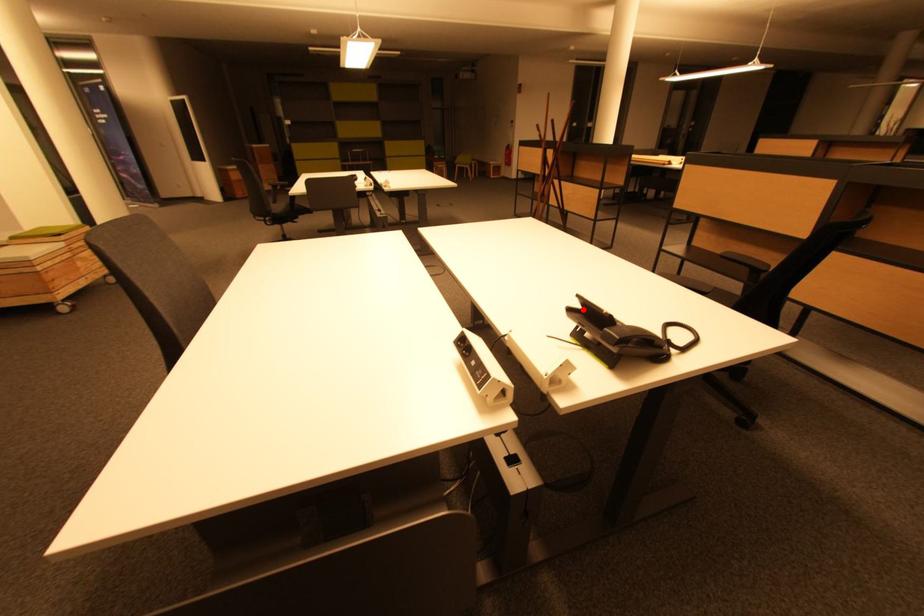
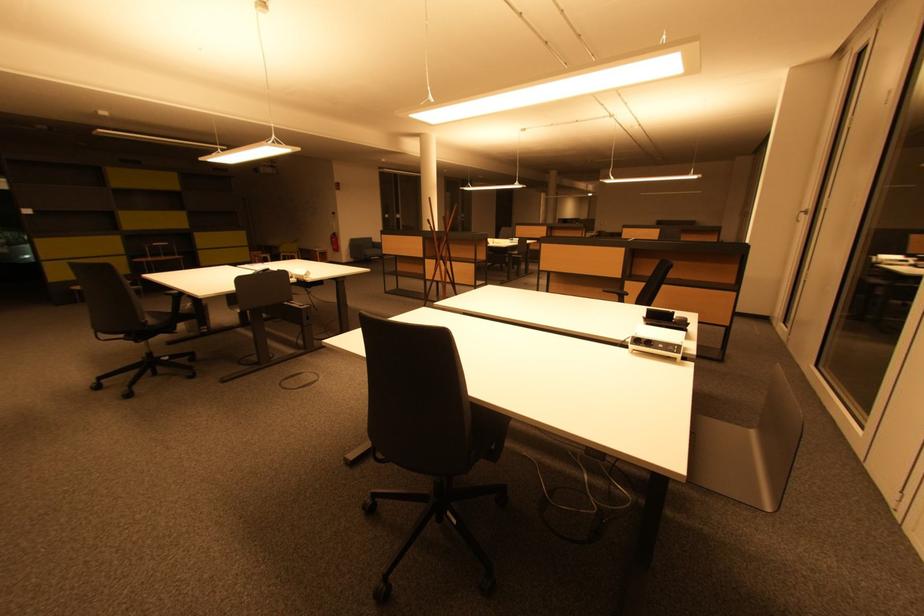
The point at the highlighted location is marked in the first image. Where is the corresponding point in the second image?

(650, 318)